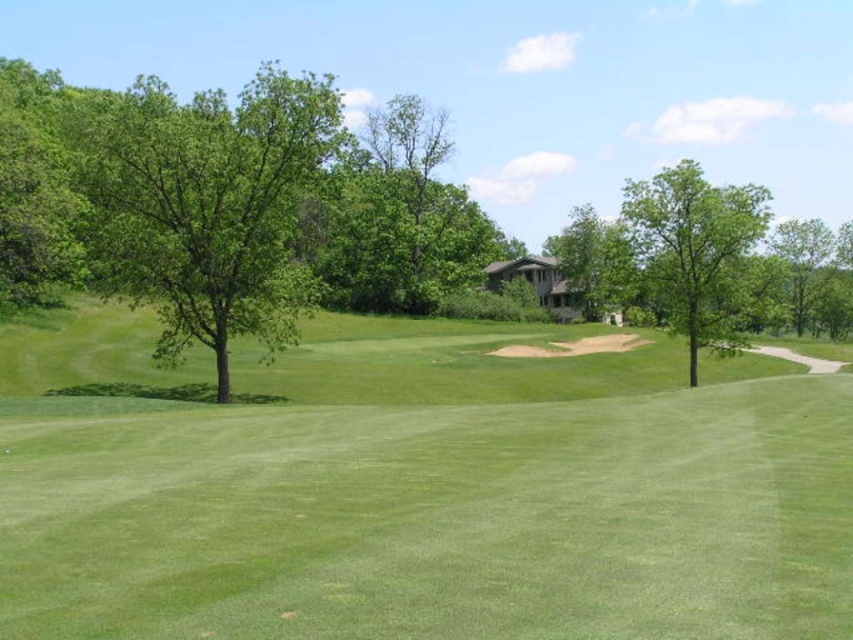
You are a golfer who wants to hit a ball from the green grassy field at center to the green leafy tree at center. Can you make the shot in one try if your maximum hitting distance is 40 meters?

The distance between the green grassy field at center and the green leafy tree at center is 42.18 meters, which exceeds your maximum hitting distance of 40 meters. Therefore, you cannot make the shot in one try.

From the picture: You are a golfer standing on the green grassy field at center, aiming to hit a ball towards the green leafy tree at upper right. Based on the distance between them, is it feasible to reach the tree in a single shot with a standard golf club?

The green grassy field at center is 193.00 feet away from the green leafy tree at upper right. With a standard golf club, which typically has a range of 150 to 250 feet depending on the club and golfer skill, it is feasible to reach the tree in a single shot.

You are a golfer standing on the tee, aiming to hit your ball towards the green. You notice the green grassy field at center and the green leafy tree at center. Which object is closer to you as you stand on the tee?

The green grassy field at center is closer to you because it is in front of the green leafy tree at center, meaning the tree is further away in the background.